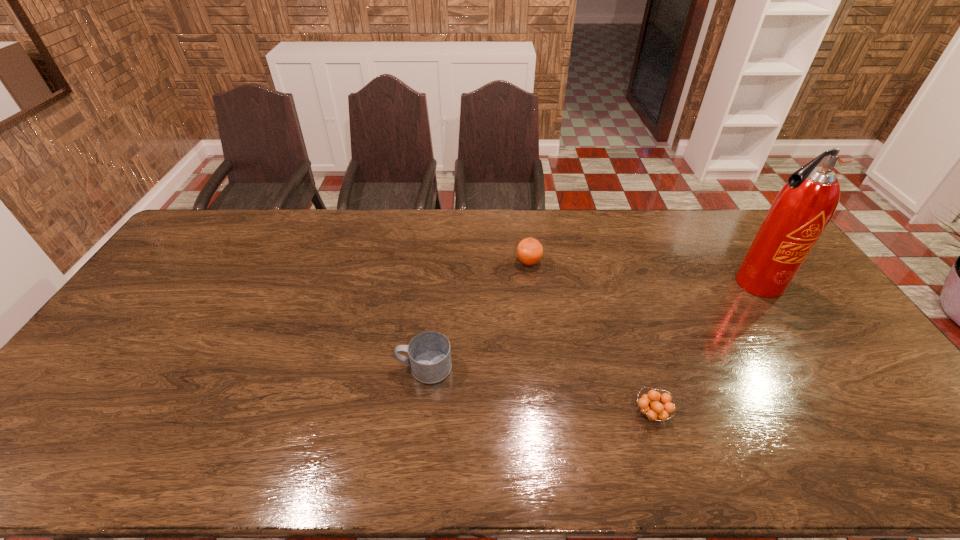
Where is `object that is the closest to the second object from right to left`? The image size is (960, 540). object that is the closest to the second object from right to left is located at coordinates (429, 353).

Identify which object is located as the second nearest to the farther orange fruit. Please provide its 2D coordinates. Your answer should be formatted as a tuple, i.e. [(x, y)], where the tuple contains the x and y coordinates of a point satisfying the conditions above.

[(652, 409)]

The width and height of the screenshot is (960, 540). I want to click on free space in the image that satisfies the following two spatial constraints: 1. on the front side of the rightmost object; 2. on the side of the third farthest object with the handle, so click(811, 367).

Locate an element on the screen. free space that satisfies the following two spatial constraints: 1. on the front side of the taller orange fruit; 2. on the left side of the rightmost object is located at coordinates (531, 283).

What are the coordinates of `free location that satisfies the following two spatial constraints: 1. on the back side of the nearer orange fruit; 2. on the side of the third farthest object with the handle` in the screenshot? It's located at (637, 367).